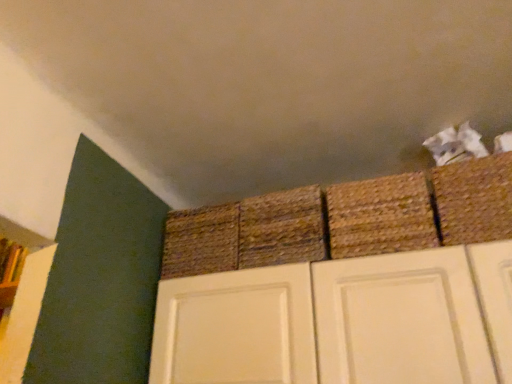
Question: Does rustic woven basket at center, the third basket from the right, have a lesser width compared to woven straw basket at center, arranged as the 1th basket when viewed from the left?

Choices:
 (A) no
 (B) yes

Answer: (A)

Question: From a real-world perspective, is rustic woven basket at center, positioned as the 2th basket in left-to-right order, on top of woven straw basket at center, arranged as the 1th basket when viewed from the left?

Choices:
 (A) no
 (B) yes

Answer: (B)

Question: Can you confirm if rustic woven basket at center, positioned as the 2th basket in left-to-right order, is shorter than woven straw basket at center, arranged as the 1th basket when viewed from the left?

Choices:
 (A) yes
 (B) no

Answer: (B)

Question: Can you confirm if rustic woven basket at center, positioned as the 2th basket in left-to-right order, is positioned to the right of woven straw basket at center, arranged as the 4th basket when viewed from the right?

Choices:
 (A) yes
 (B) no

Answer: (A)

Question: Is rustic woven basket at center, the third basket from the right, positioned beyond the bounds of woven straw basket at center, arranged as the 4th basket when viewed from the right?

Choices:
 (A) no
 (B) yes

Answer: (B)

Question: Do you think rustic woven basket at upper right, arranged as the third basket when viewed from the left, is within rustic woven basket at center, positioned as the 2th basket in left-to-right order, or outside of it?

Choices:
 (A) outside
 (B) inside

Answer: (A)

Question: Relative to rustic woven basket at center, the third basket from the right, is rustic woven basket at upper right, positioned as the 2th basket in right-to-left order, in front or behind?

Choices:
 (A) behind
 (B) front

Answer: (B)

Question: In terms of width, does rustic woven basket at upper right, positioned as the 2th basket in right-to-left order, look wider or thinner when compared to rustic woven basket at center, positioned as the 2th basket in left-to-right order?

Choices:
 (A) thin
 (B) wide

Answer: (A)

Question: Visually, is rustic woven basket at upper right, positioned as the 2th basket in right-to-left order, positioned to the left or to the right of rustic woven basket at center, positioned as the 2th basket in left-to-right order?

Choices:
 (A) right
 (B) left

Answer: (A)

Question: Would you say rustic woven basket at center, the third basket from the right, is to the left or to the right of rustic woven basket at upper right, arranged as the third basket when viewed from the left, in the picture?

Choices:
 (A) right
 (B) left

Answer: (B)

Question: Considering the positions of rustic woven basket at center, the third basket from the right, and rustic woven basket at upper right, positioned as the 2th basket in right-to-left order, in the image, is rustic woven basket at center, the third basket from the right, wider or thinner than rustic woven basket at upper right, positioned as the 2th basket in right-to-left order,?

Choices:
 (A) thin
 (B) wide

Answer: (B)

Question: Based on their sizes in the image, would you say rustic woven basket at center, the third basket from the right, is bigger or smaller than rustic woven basket at upper right, positioned as the 2th basket in right-to-left order?

Choices:
 (A) small
 (B) big

Answer: (B)

Question: Does point (261, 248) appear closer or farther from the camera than point (419, 182)?

Choices:
 (A) farther
 (B) closer

Answer: (A)

Question: Does point (505, 168) appear closer or farther from the camera than point (238, 236)?

Choices:
 (A) closer
 (B) farther

Answer: (A)

Question: In the image, is braided straw basket at upper right, which is the fourth basket in left-to-right order, positioned in front of or behind woven straw basket at center, arranged as the 1th basket when viewed from the left?

Choices:
 (A) front
 (B) behind

Answer: (A)